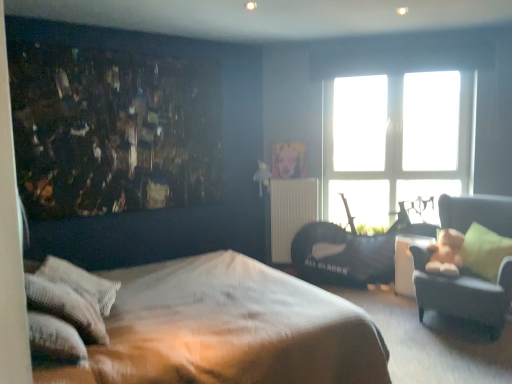
Question: From a real-world perspective, is brown textured bed at center positioned over white textured pillow at lower left, the 2th pillow viewed from the front, based on gravity?

Choices:
 (A) no
 (B) yes

Answer: (A)

Question: Is brown textured bed at center turned away from white textured pillow at lower left, the 2th pillow viewed from the front?

Choices:
 (A) no
 (B) yes

Answer: (B)

Question: Considering the relative sizes of brown textured bed at center and white textured pillow at lower left, the second pillow in the back-to-front sequence, in the image provided, is brown textured bed at center smaller than white textured pillow at lower left, the second pillow in the back-to-front sequence,?

Choices:
 (A) yes
 (B) no

Answer: (B)

Question: Considering the relative sizes of brown textured bed at center and white textured pillow at lower left, the third pillow in the right-to-left sequence, in the image provided, is brown textured bed at center shorter than white textured pillow at lower left, the third pillow in the right-to-left sequence,?

Choices:
 (A) yes
 (B) no

Answer: (B)

Question: Is brown textured bed at center bigger than white textured pillow at lower left, the third pillow in the right-to-left sequence?

Choices:
 (A) yes
 (B) no

Answer: (A)

Question: From a real-world perspective, is brown textured bed at center positioned under white textured pillow at lower left, the 2th pillow viewed from the front, based on gravity?

Choices:
 (A) no
 (B) yes

Answer: (B)

Question: Is white textured pillow at lower left, the first pillow viewed from the front, thinner than green fabric pillow at right, the third pillow from the front?

Choices:
 (A) yes
 (B) no

Answer: (A)

Question: From a real-world perspective, is white textured pillow at lower left, marked as the second pillow in a right-to-left arrangement, positioned over green fabric pillow at right, arranged as the first pillow when viewed from the right, based on gravity?

Choices:
 (A) no
 (B) yes

Answer: (B)

Question: Is white textured pillow at lower left, the second pillow when ordered from left to right, bigger than green fabric pillow at right, arranged as the first pillow when viewed from the right?

Choices:
 (A) no
 (B) yes

Answer: (A)

Question: From the image's perspective, would you say white textured pillow at lower left, marked as the second pillow in a right-to-left arrangement, is positioned over green fabric pillow at right, arranged as the first pillow when viewed from the right?

Choices:
 (A) yes
 (B) no

Answer: (B)

Question: Is green fabric pillow at right, arranged as the 1th pillow when viewed from the back, located within white textured pillow at lower left, the first pillow viewed from the front?

Choices:
 (A) yes
 (B) no

Answer: (B)

Question: Does white textured pillow at lower left, marked as the second pillow in a right-to-left arrangement, appear on the left side of green fabric pillow at right, arranged as the 1th pillow when viewed from the back?

Choices:
 (A) yes
 (B) no

Answer: (A)

Question: Is brown textured bed at center further to the viewer compared to black leather swivel chair at right?

Choices:
 (A) no
 (B) yes

Answer: (A)